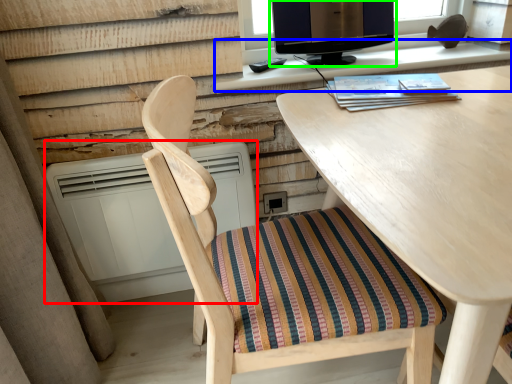
Question: Based on their relative distances, which object is nearer to air conditioner (highlighted by a red box)? Choose from computer desk (highlighted by a blue box) and computer monitor (highlighted by a green box).

Choices:
 (A) computer desk
 (B) computer monitor

Answer: (A)